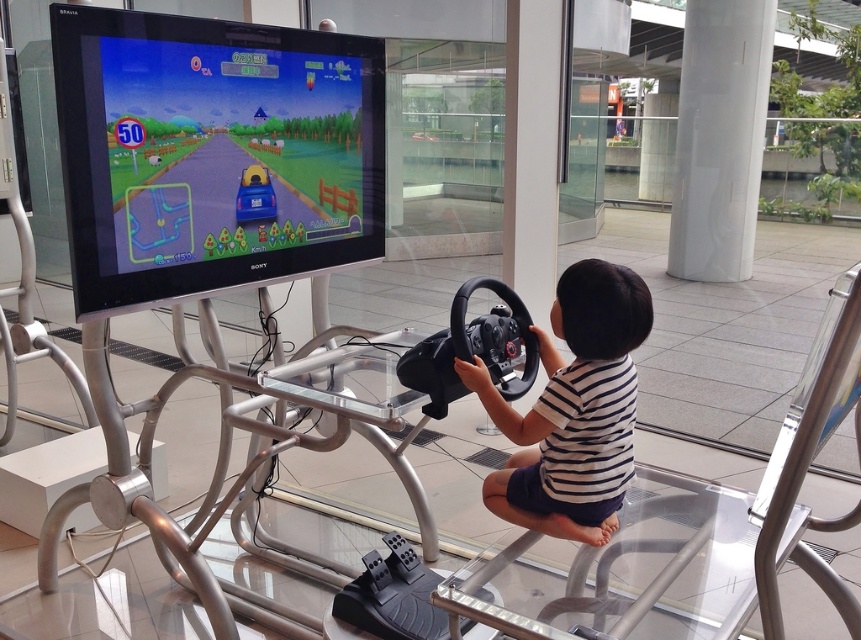
Question: Does white striped shirt at center have a larger size compared to white glossy pillar at upper right?

Choices:
 (A) yes
 (B) no

Answer: (B)

Question: Which object is positioned closest to the white glossy pillar at upper right?

Choices:
 (A) matte plastic screen at upper left
 (B) white striped shirt at center

Answer: (B)

Question: Which of the following is the farthest from the observer?

Choices:
 (A) (574, 476)
 (B) (175, 284)

Answer: (B)

Question: Which of the following is the closest to the observer?

Choices:
 (A) matte plastic screen at upper left
 (B) white glossy pillar at upper right

Answer: (A)

Question: Is matte plastic screen at upper left behind white glossy pillar at upper right?

Choices:
 (A) yes
 (B) no

Answer: (B)

Question: Can you confirm if matte plastic screen at upper left is thinner than white striped shirt at center?

Choices:
 (A) yes
 (B) no

Answer: (B)